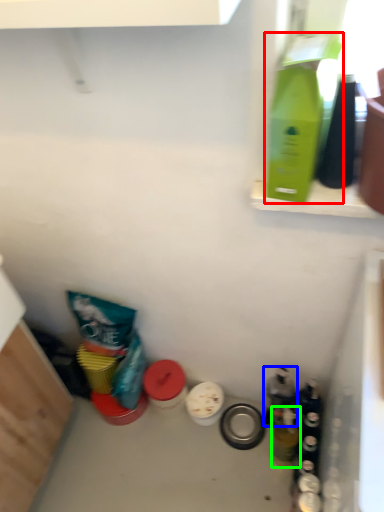
Question: Which is farther away from bottle (highlighted by a red box)? bottle (highlighted by a blue box) or bottle (highlighted by a green box)?

Choices:
 (A) bottle
 (B) bottle

Answer: (B)